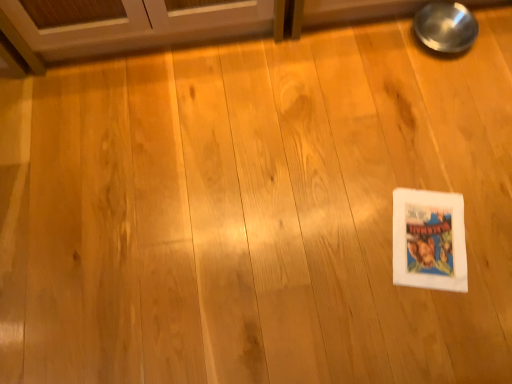
What is the approximate width of metallic reflective bowl at upper right?

It is 7.98 inches.

Describe the element at coordinates (446, 27) in the screenshot. The height and width of the screenshot is (384, 512). I see `metallic reflective bowl at upper right` at that location.

You are a GUI agent. You are given a task and a screenshot of the screen. Output one action in this format:
    pyautogui.click(x=<x>, y=<y>)
    Task: Click on the metallic reflective bowl at upper right
    The image size is (512, 384).
    Given the screenshot: What is the action you would take?
    pyautogui.click(x=446, y=27)

What do you see at coordinates (429, 240) in the screenshot? Image resolution: width=512 pixels, height=384 pixels. I see `white paper comic book at lower right` at bounding box center [429, 240].

Where is `white paper comic book at lower right`? The height and width of the screenshot is (384, 512). white paper comic book at lower right is located at coordinates (429, 240).

At what (x,y) coordinates should I click in order to perform the action: click on metallic reflective bowl at upper right. Please return your answer as a coordinate pair (x, y). This screenshot has width=512, height=384. Looking at the image, I should click on (446, 27).

Which object is positioned more to the right, white paper comic book at lower right or metallic reflective bowl at upper right?

metallic reflective bowl at upper right.

Is the position of white paper comic book at lower right less distant than that of metallic reflective bowl at upper right?

Yes, white paper comic book at lower right is closer to the camera.

Which is farther, (393, 264) or (432, 42)?

The point (432, 42) is farther.

From the image's perspective, is white paper comic book at lower right located beneath metallic reflective bowl at upper right?

Yes.

From a real-world perspective, between white paper comic book at lower right and metallic reflective bowl at upper right, who is vertically higher?

In real-world perspective, metallic reflective bowl at upper right is above.

Which of these two, white paper comic book at lower right or metallic reflective bowl at upper right, is wider?

white paper comic book at lower right is wider.

Considering the sizes of white paper comic book at lower right and metallic reflective bowl at upper right in the image, is white paper comic book at lower right taller or shorter than metallic reflective bowl at upper right?

Considering their sizes, white paper comic book at lower right has less height than metallic reflective bowl at upper right.

Is white paper comic book at lower right bigger than metallic reflective bowl at upper right?

Actually, white paper comic book at lower right might be smaller than metallic reflective bowl at upper right.

Which is correct: white paper comic book at lower right is inside metallic reflective bowl at upper right, or outside of it?

white paper comic book at lower right cannot be found inside metallic reflective bowl at upper right.

Would you say white paper comic book at lower right is a long distance from metallic reflective bowl at upper right?

That's not correct — white paper comic book at lower right is a little close to metallic reflective bowl at upper right.

Is white paper comic book at lower right aimed at metallic reflective bowl at upper right?

No, white paper comic book at lower right is not oriented towards metallic reflective bowl at upper right.

Image resolution: width=512 pixels, height=384 pixels. In order to click on comic book below the metallic reflective bowl at upper right (from a real-world perspective) in this screenshot , I will do `click(429, 240)`.

Which object is positioned more to the left, metallic reflective bowl at upper right or white paper comic book at lower right?

Positioned to the left is white paper comic book at lower right.

Is the position of metallic reflective bowl at upper right more distant than that of white paper comic book at lower right?

Yes, metallic reflective bowl at upper right is behind white paper comic book at lower right.

Does point (433, 39) come in front of point (432, 283)?

No, (433, 39) is further to viewer.

From the image's perspective, who appears lower, metallic reflective bowl at upper right or white paper comic book at lower right?

From the image's view, white paper comic book at lower right is below.

From a real-world perspective, is metallic reflective bowl at upper right located beneath white paper comic book at lower right?

No.

Looking at their sizes, would you say metallic reflective bowl at upper right is wider or thinner than white paper comic book at lower right?

In the image, metallic reflective bowl at upper right appears to be more narrow than white paper comic book at lower right.

Does metallic reflective bowl at upper right have a greater height compared to white paper comic book at lower right?

Yes, metallic reflective bowl at upper right is taller than white paper comic book at lower right.

Can you confirm if metallic reflective bowl at upper right is bigger than white paper comic book at lower right?

Yes.

Is metallic reflective bowl at upper right not within white paper comic book at lower right?

Yes.

Is metallic reflective bowl at upper right next to white paper comic book at lower right and touching it?

No.

Could you tell me if metallic reflective bowl at upper right is facing white paper comic book at lower right?

Yes, metallic reflective bowl at upper right faces towards white paper comic book at lower right.

How different are the orientations of metallic reflective bowl at upper right and white paper comic book at lower right in degrees?

They differ by 105 degrees in their facing directions.

Could you measure the distance between metallic reflective bowl at upper right and white paper comic book at lower right?

The distance of metallic reflective bowl at upper right from white paper comic book at lower right is 68.15 centimeters.

At what (x,y) coordinates should I click in order to perform the action: click on comic book in front of the metallic reflective bowl at upper right. Please return your answer as a coordinate pair (x, y). This screenshot has height=384, width=512. Looking at the image, I should click on (429, 240).

Find the location of `bowl lying behind the white paper comic book at lower right`. bowl lying behind the white paper comic book at lower right is located at coordinates 446,27.

Where is `comic book on the left of metallic reflective bowl at upper right`? The width and height of the screenshot is (512, 384). comic book on the left of metallic reflective bowl at upper right is located at coordinates (429, 240).